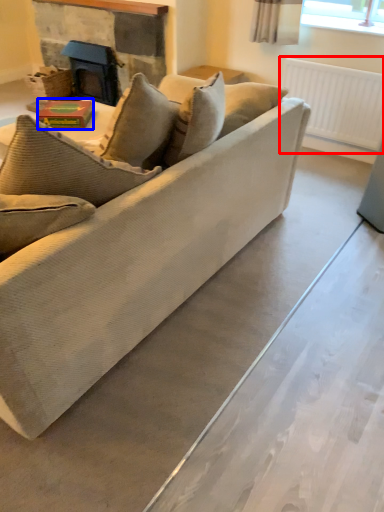
Question: Which object is closer to the camera taking this photo, radiator (highlighted by a red box) or book (highlighted by a blue box)?

Choices:
 (A) radiator
 (B) book

Answer: (B)